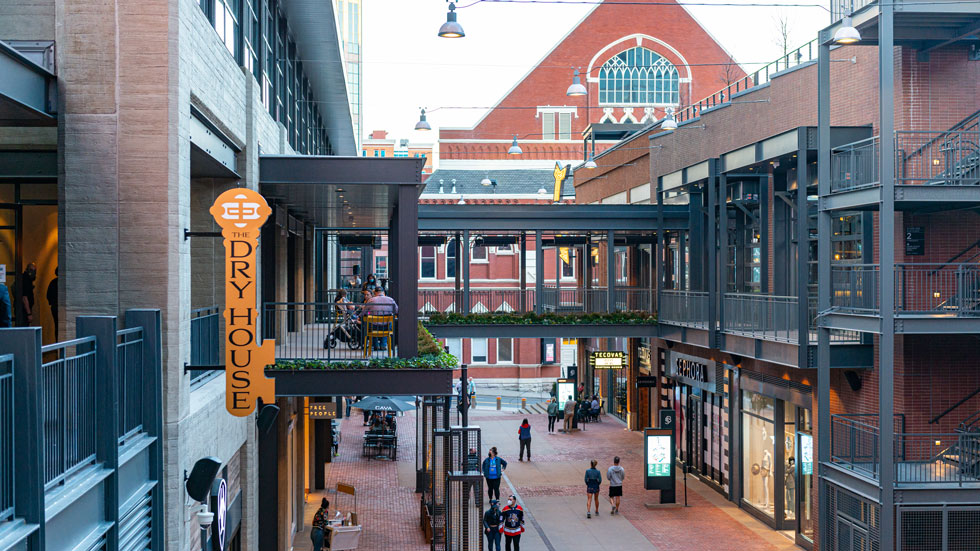
Locate an element on the screen. The width and height of the screenshot is (980, 551). techovas neon sign is located at coordinates (608, 360).